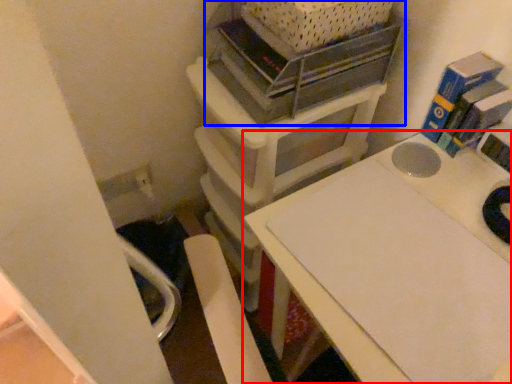
Question: Which object appears farthest to the camera in this image, table (highlighted by a red box) or shelf (highlighted by a blue box)?

Choices:
 (A) table
 (B) shelf

Answer: (B)